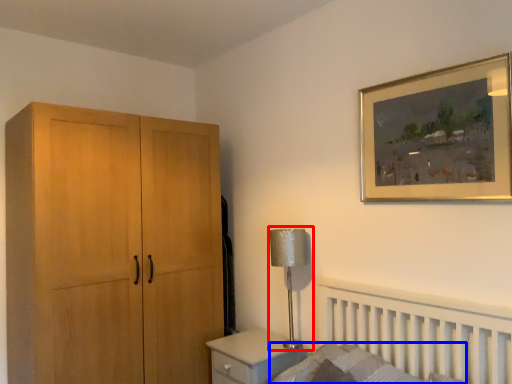
Question: Which of the following is the closest to the observer, table lamp (highlighted by a red box) or mattress (highlighted by a blue box)?

Choices:
 (A) table lamp
 (B) mattress

Answer: (B)